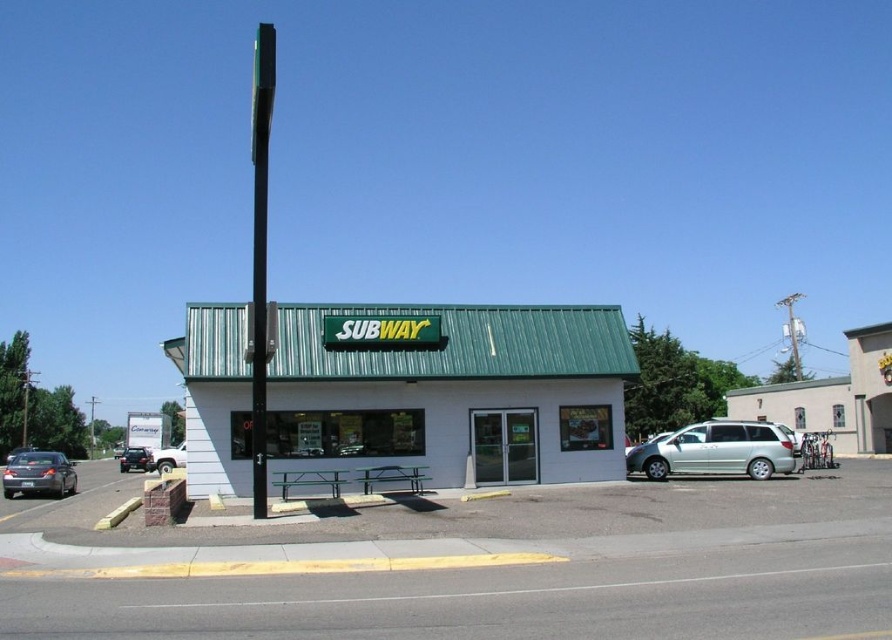
Question: In this image, where is matte black sedan at lower left located relative to white matte truck at lower left?

Choices:
 (A) above
 (B) below

Answer: (A)

Question: Considering the real-world distances, which object is closest to the green matte pole at center?

Choices:
 (A) shiny black sedan at left
 (B) matte black sedan at lower left

Answer: (A)

Question: Which point is farther from the camera taking this photo?

Choices:
 (A) (767, 477)
 (B) (172, 355)
 (C) (261, 467)
 (D) (127, 467)

Answer: (D)

Question: Is matte black sedan at lower left above white matte truck at lower left?

Choices:
 (A) yes
 (B) no

Answer: (A)

Question: Which object appears closest to the camera in this image?

Choices:
 (A) matte black sedan at lower left
 (B) white matte building at center

Answer: (B)

Question: Where is matte black sedan at lower left located in relation to white matte truck at lower left in the image?

Choices:
 (A) right
 (B) left

Answer: (B)